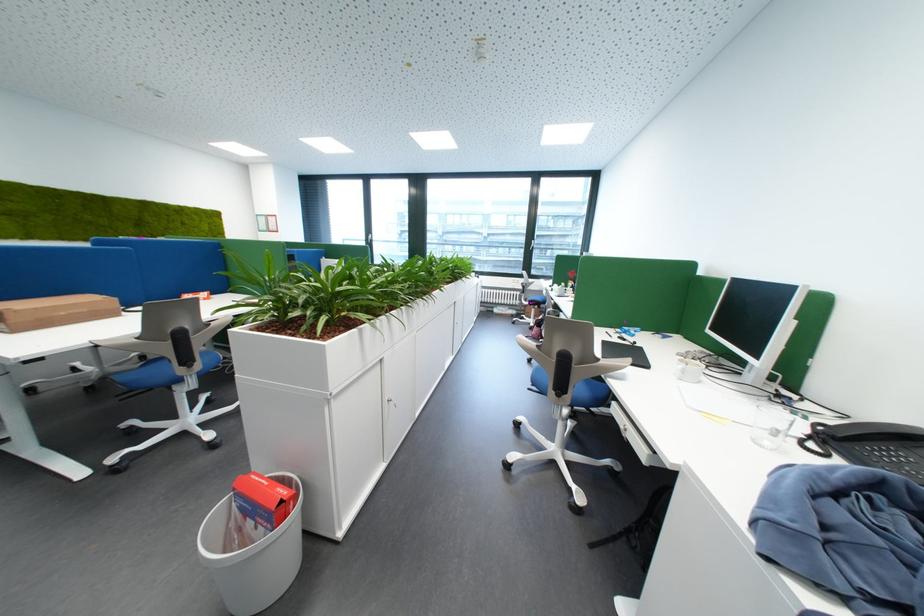
Where is `telephone handset`? This screenshot has width=924, height=616. telephone handset is located at coordinates (872, 429).